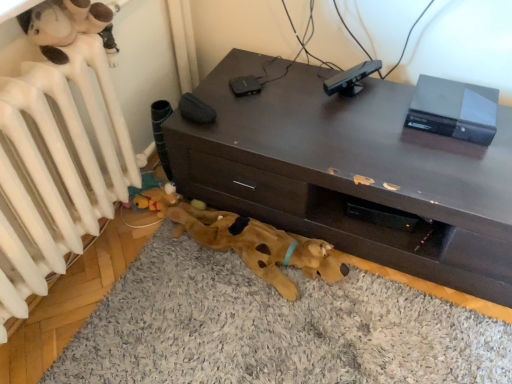
Where is `free space in front of black matte sensor at upper center`? free space in front of black matte sensor at upper center is located at coordinates (358, 118).